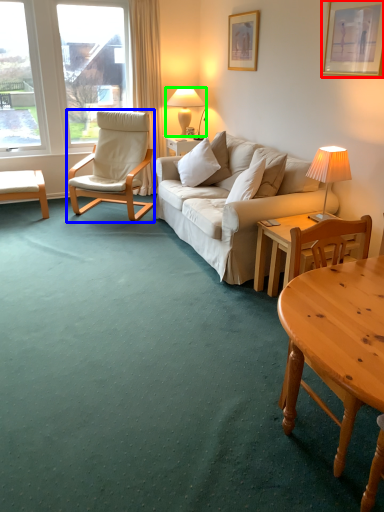
Question: Based on their relative distances, which object is farther from picture frame (highlighted by a red box)? Choose from chair (highlighted by a blue box) and lamp (highlighted by a green box).

Choices:
 (A) chair
 (B) lamp

Answer: (A)